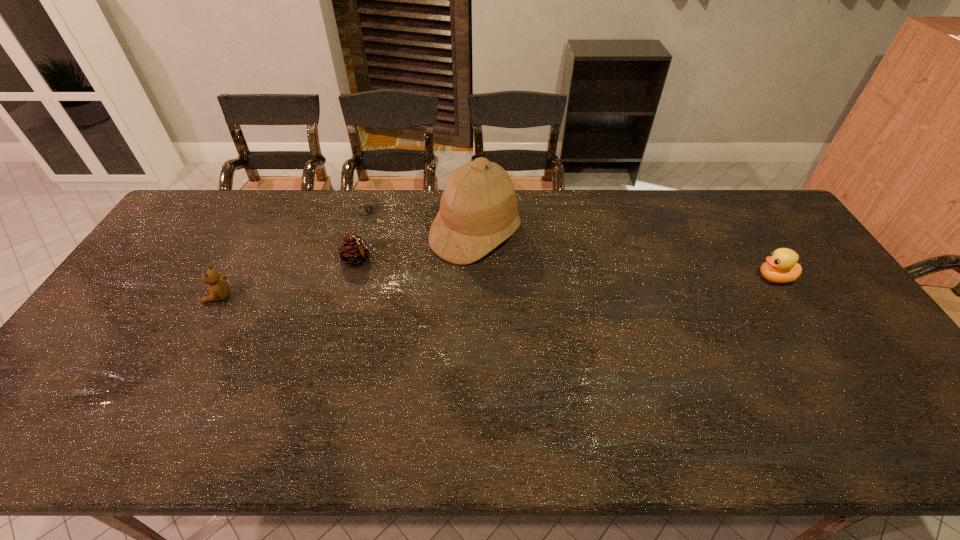
Find the location of `the leftmost object`. the leftmost object is located at coordinates (218, 289).

Identify the location of duckling. (781, 267).

This screenshot has width=960, height=540. I want to click on pinecone, so click(353, 250).

The width and height of the screenshot is (960, 540). What are the coordinates of `the shortest object` in the screenshot? It's located at (x=370, y=208).

You are a GUI agent. You are given a task and a screenshot of the screen. Output one action in this format:
    pyautogui.click(x=<x>, y=<y>)
    Task: Click on the fourth object from left to right
    Image resolution: width=960 pixels, height=540 pixels.
    Given the screenshot: What is the action you would take?
    pyautogui.click(x=478, y=211)

The height and width of the screenshot is (540, 960). I want to click on the tallest object, so click(478, 211).

Where is `free space located 0.150m on the front-facing side of the leftmost object`? free space located 0.150m on the front-facing side of the leftmost object is located at coordinates (153, 297).

Where is `free space located on the front-facing side of the leftmost object`? The image size is (960, 540). free space located on the front-facing side of the leftmost object is located at coordinates (160, 297).

You are a GUI agent. You are given a task and a screenshot of the screen. Output one action in this format:
    pyautogui.click(x=<x>, y=<y>)
    Task: Click on the free space located on the front-facing side of the leftmost object
    Image resolution: width=960 pixels, height=540 pixels.
    Given the screenshot: What is the action you would take?
    pyautogui.click(x=170, y=297)

Find the location of `blank space located 0.220m on the face of the duckling`. blank space located 0.220m on the face of the duckling is located at coordinates (682, 278).